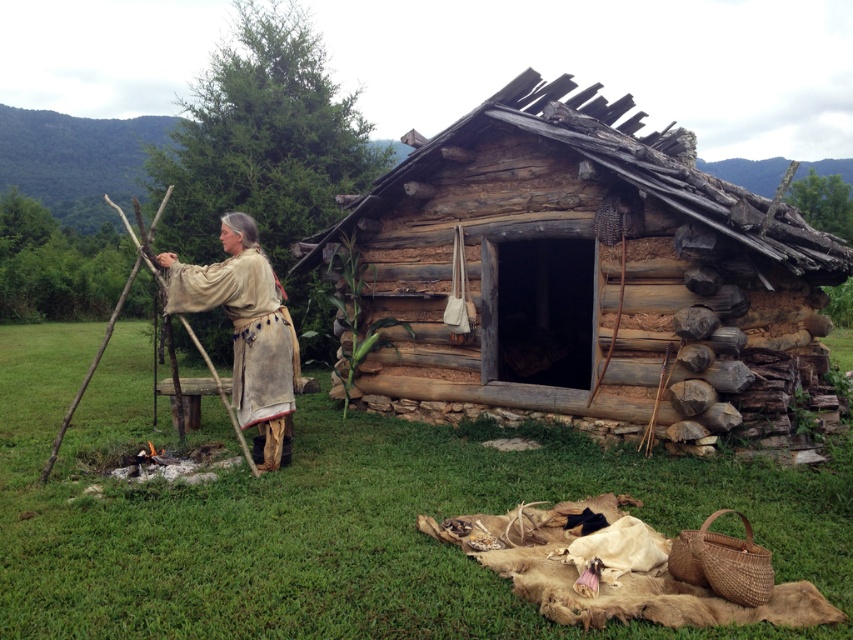
Consider the image. You are standing in the rustic outdoor scene described. You notice a point at coordinates (590, 278). What object is located at that point?

The weathered wood cabin at center is located at point (590, 278).

You are a visitor approaching the weathered wood cabin at center and the beige leather robe at center in this rustic outdoor scene. Which object would you encounter first as you move towards them from a distance?

The beige leather robe at center is encountered first because it is positioned below the weathered wood cabin at center, making it closer to the viewer.

You are an observer standing in front of the weathered wood cabin at center and the beige leather robe at center. Which object appears taller in the image?

The beige leather robe at center appears taller than the weathered wood cabin at center.